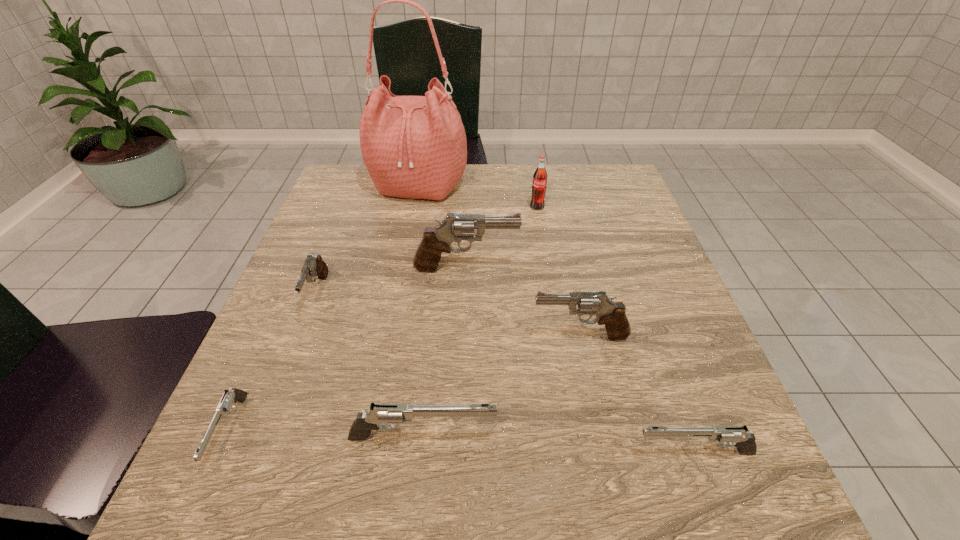
At what (x,y) coordinates should I click in order to perform the action: click on vacant space located at the barrel of the seventh object from right to left. Please return your answer as a coordinate pair (x, y). Image resolution: width=960 pixels, height=540 pixels. Looking at the image, I should click on (275, 404).

Where is `blank space located 0.050m on the front-facing side of the second shortest pistol`? blank space located 0.050m on the front-facing side of the second shortest pistol is located at coordinates (600, 453).

Where is `free spot located 0.250m on the front-facing side of the second shortest pistol`? Image resolution: width=960 pixels, height=540 pixels. free spot located 0.250m on the front-facing side of the second shortest pistol is located at coordinates (466, 453).

At what (x,y) coordinates should I click in order to perform the action: click on vacant space located on the front-facing side of the second shortest pistol. Please return your answer as a coordinate pair (x, y). Looking at the image, I should click on (540, 453).

You are a GUI agent. You are given a task and a screenshot of the screen. Output one action in this format:
    pyautogui.click(x=<x>, y=<y>)
    Task: Click on the handbag located in the far edge section of the desktop
    This screenshot has height=540, width=960.
    Given the screenshot: What is the action you would take?
    pyautogui.click(x=415, y=147)

Locate an element on the screen. The width and height of the screenshot is (960, 540). soda bottle located at the far edge is located at coordinates (539, 183).

Find the location of a particular element. This screenshot has width=960, height=540. object that is at the near edge is located at coordinates click(229, 398).

Where is `handbag located in the left edge section of the desktop`? The height and width of the screenshot is (540, 960). handbag located in the left edge section of the desktop is located at coordinates (415, 147).

Image resolution: width=960 pixels, height=540 pixels. I want to click on object at the far left corner, so [x=415, y=147].

Locate an element on the screen. The image size is (960, 540). object at the near left corner is located at coordinates (229, 398).